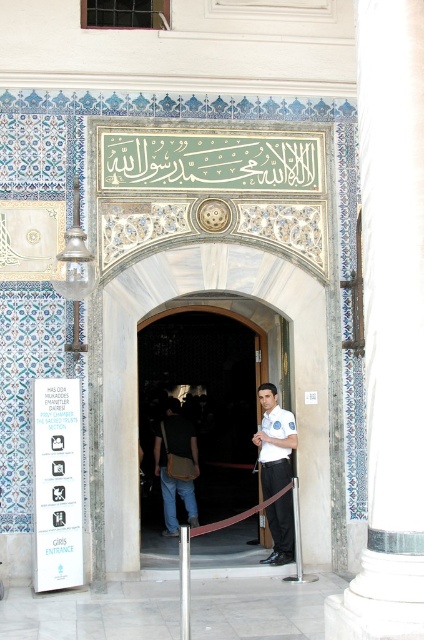
Between point (421, 26) and point (276, 445), which one is positioned behind?

Point (276, 445)

Which is below, white marble pillar at center or white uniform at center?

white uniform at center

The image size is (424, 640). I want to click on white marble pillar at center, so click(390, 324).

Between white marble pillar at center and wooden door at center, which one appears on the right side from the viewer's perspective?

white marble pillar at center

Can you confirm if white marble pillar at center is shorter than wooden door at center?

In fact, white marble pillar at center may be taller than wooden door at center.

Locate an element on the screen. The width and height of the screenshot is (424, 640). white marble pillar at center is located at coordinates (390, 324).

The image size is (424, 640). I want to click on white marble pillar at center, so click(x=390, y=324).

Between point (367, 621) and point (170, 410), which one is positioned behind?

Point (170, 410)

Where is `white marble pillar at center`? Image resolution: width=424 pixels, height=640 pixels. white marble pillar at center is located at coordinates (390, 324).